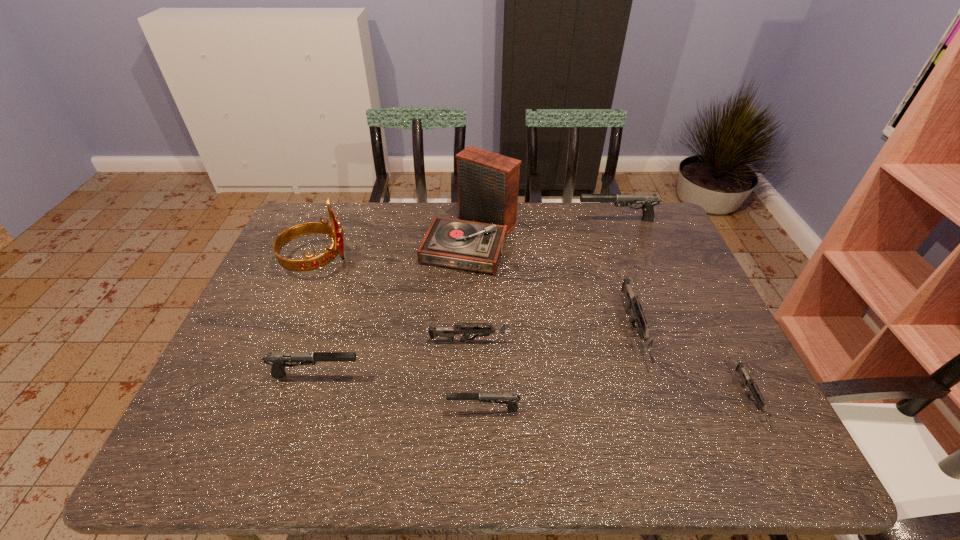
Where is `the rightmost gun`? the rightmost gun is located at coordinates (746, 380).

Image resolution: width=960 pixels, height=540 pixels. I want to click on the shortest object, so click(746, 380).

The image size is (960, 540). I want to click on free space located 0.390m on the front of the phonograph record, so click(477, 393).

You are a GUI agent. You are given a task and a screenshot of the screen. Output one action in this format:
    pyautogui.click(x=<x>, y=<y>)
    Task: Click on the free space located on the front-facing side of the red tiara
    
    Given the screenshot: What is the action you would take?
    pyautogui.click(x=468, y=260)

Locate an element on the screen. This screenshot has width=960, height=540. free space located at the muzzle end of the farthest gun is located at coordinates (509, 220).

This screenshot has width=960, height=540. I want to click on vacant space located 0.100m at the muzzle end of the farthest gun, so click(547, 220).

Where is `vacant area located 0.160m at the muzzle end of the farthest gun`? This screenshot has width=960, height=540. vacant area located 0.160m at the muzzle end of the farthest gun is located at coordinates (530, 220).

Identify the location of vacant region located 0.080m aimed along the barrel of the second grey gun from right to left. (659, 405).

Identify the location of vacant space located at the muzzle end of the second smallest gray gun. (391, 375).

At what (x,y) coordinates should I click in order to perform the action: click on vacant region located 0.050m aimed along the barrel of the leftmost grey gun. Please return your answer as a coordinate pair (x, y). Looking at the image, I should click on (535, 341).